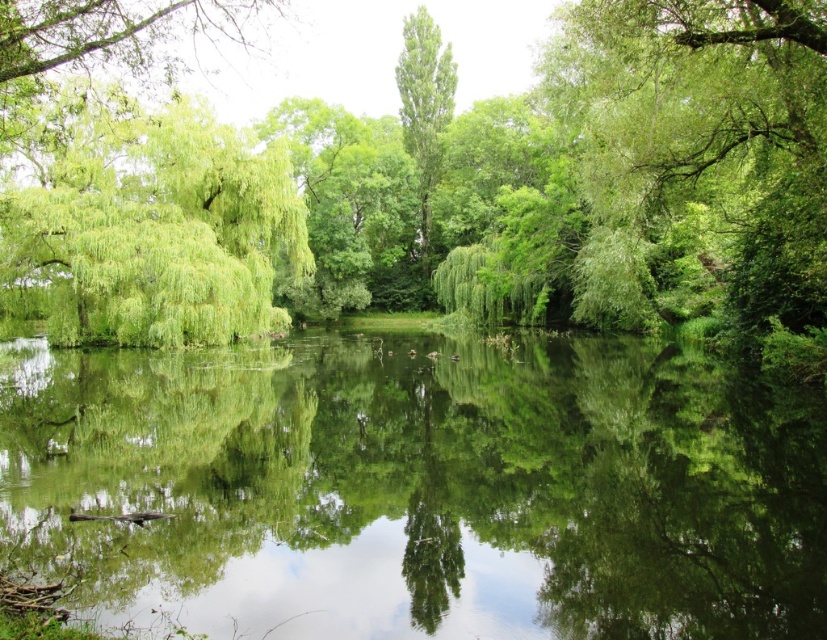
You are planning to install a floating dock on the green reflective water at center. The dock requires a minimum of 60 feet of space between it and any nearby trees to avoid branches overhanging into the water. Based on the scene, will the green leafy tree at center allow enough space for the dock?

The green reflective water at center and green leafy tree at center are 62.82 feet apart from each other. Since the required minimum space is 60 feet, the distance is sufficient, so the dock can be installed without violating the spacing requirement.

You are a bird seeking a nesting spot. You notice two trees in the center of the scene, the green leafy tree at center and the green leafy willow at center. Which tree has a wider canopy to accommodate your nest?

The green leafy tree at center has a wider canopy than the green leafy willow at center, so it would be more suitable for nesting.